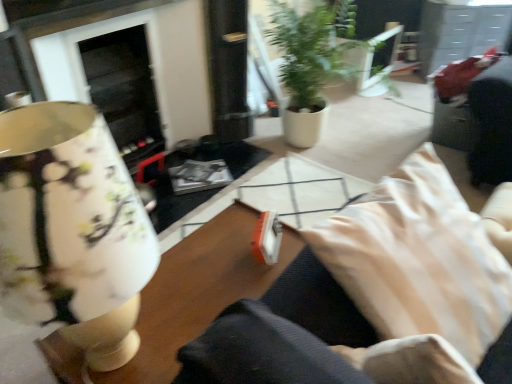
The image size is (512, 384). In order to click on vacant space in matte floral lampshade at left (from a real-world perspective) in this screenshot , I will do `click(126, 356)`.